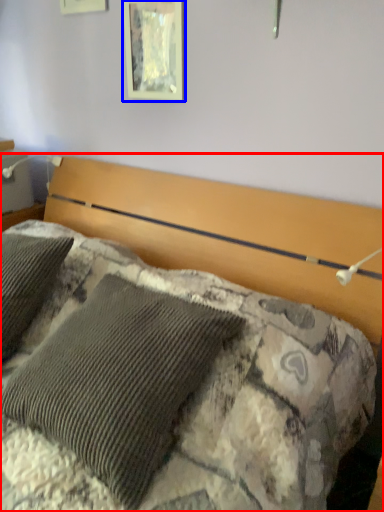
Question: Which object appears closest to the camera in this image, bed (highlighted by a red box) or picture frame (highlighted by a blue box)?

Choices:
 (A) bed
 (B) picture frame

Answer: (A)